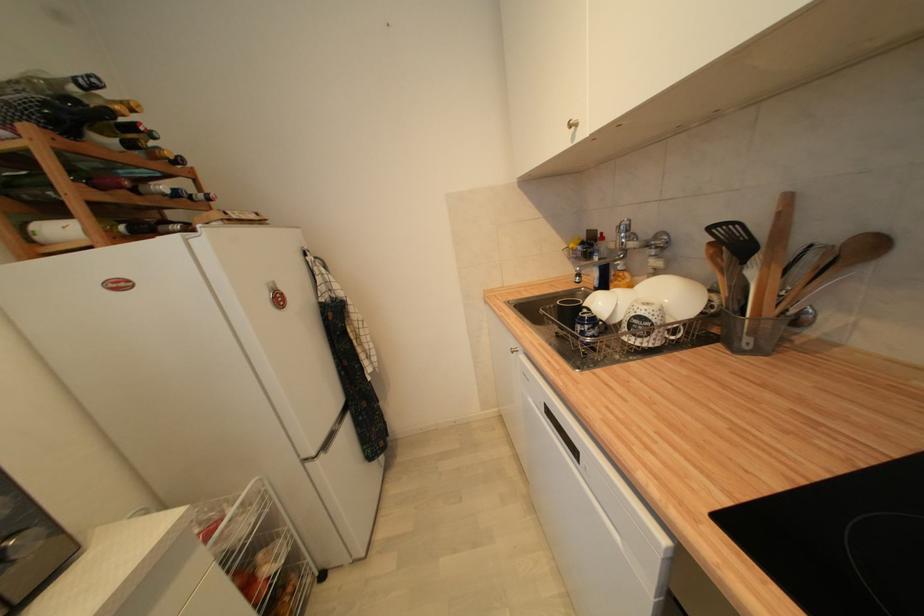
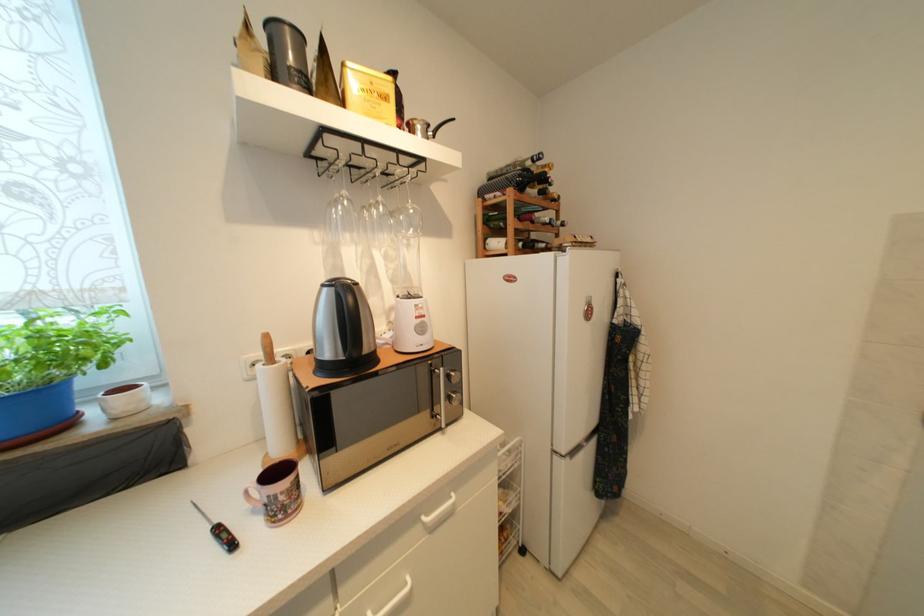
In the second image, find the point that corresponds to the point at 326,456 in the first image.

(573, 461)